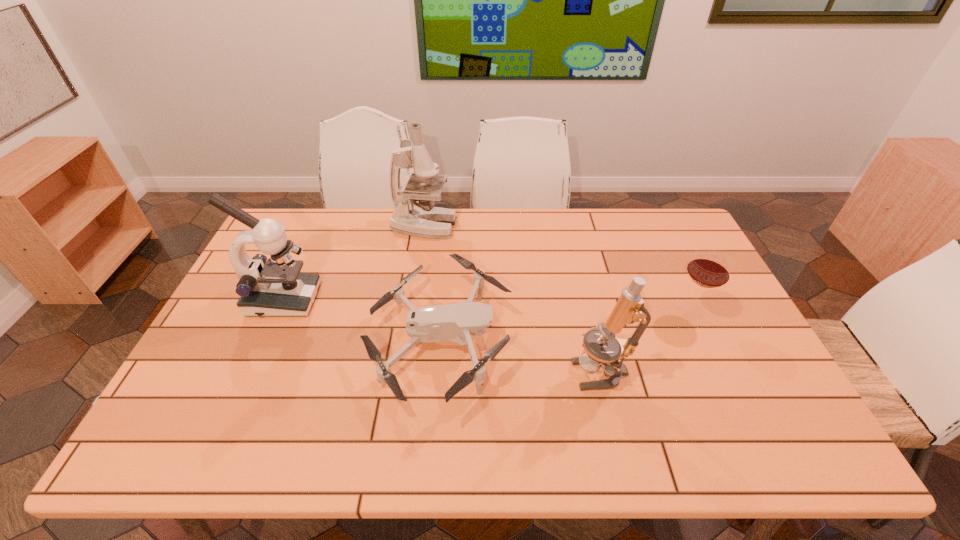
The image size is (960, 540). What are the coordinates of `vacant space that satisfies the following two spatial constraints: 1. on the front side of the wineglass; 2. with a camera at the front of the drone` in the screenshot? It's located at (707, 343).